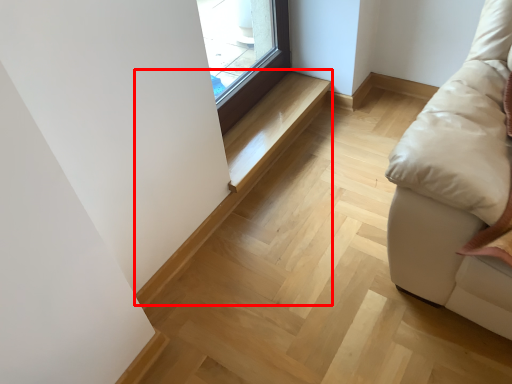
Question: From the image's perspective, considering the relative positions of stairwell (annotated by the red box) and stairwell in the image provided, where is stairwell (annotated by the red box) located with respect to the staircase?

Choices:
 (A) above
 (B) below

Answer: (B)